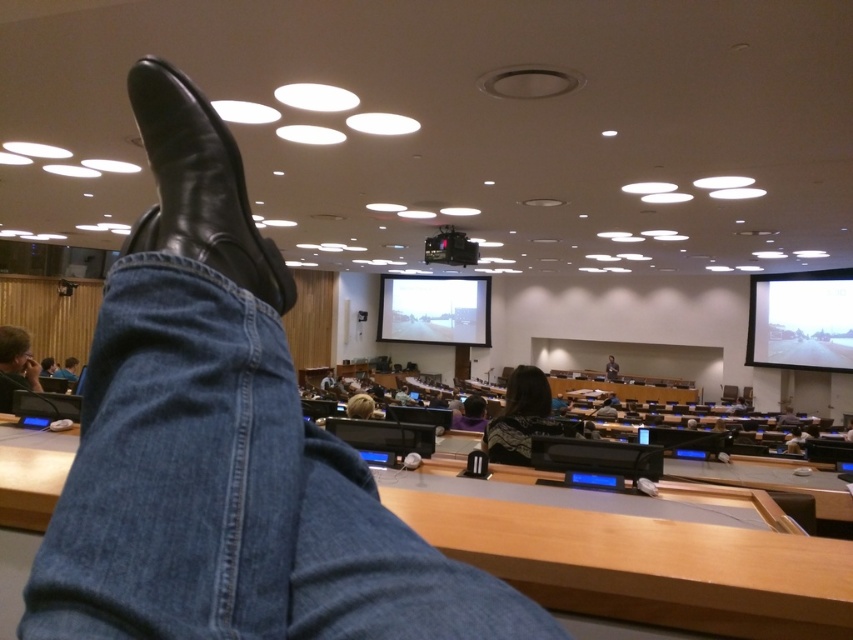
You are organizing a small event and need to place two items in the scene. You have a decorative plant and a name tag holder. The denim jeans at upper left and the matte white screen at right are already present. According to the spatial arrangement, where should you place the decorative plant and name tag holder so they are both visible from the front of the room?

The denim jeans at upper left is positioned on the left side of matte white screen at right. To ensure visibility from the front, place the decorative plant to the left of the denim jeans at upper left and the name tag holder to the right of the matte white screen at right.

You are sitting at a desk in a conference room and want to check both your denim jeans at upper left and the matte white screen at right. Which object is nearer to you?

The denim jeans at upper left is closer to the viewer than the matte white screen at right.

You are organizing a small event in this room and need to place a 1.2 meter wide banner between the black leather boot at upper center and the dark brown leather shoe at lower left. Is there enough space between them to fit the banner?

The black leather boot at upper center is positioned on the left side of dark brown leather shoe at lower left, but the distance between them is not specified. Therefore, it is uncertain if the 1.2 meter wide banner can fit between them.